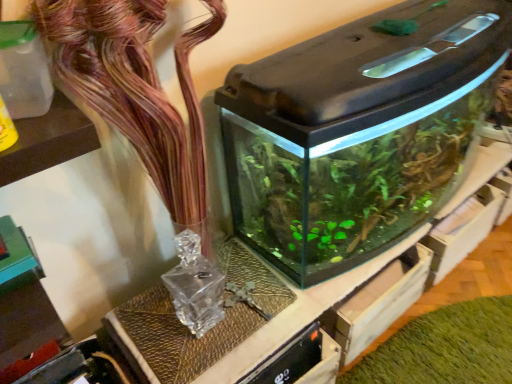
You are a GUI agent. You are given a task and a screenshot of the screen. Output one action in this format:
    pyautogui.click(x=<x>, y=<y>)
    Task: Click on the translucent glass vase at upper center
    The image size is (512, 384).
    Given the screenshot: What is the action you would take?
    pyautogui.click(x=136, y=90)

This screenshot has height=384, width=512. What do you see at coordinates (445, 347) in the screenshot? I see `green matte plant at lower right` at bounding box center [445, 347].

The width and height of the screenshot is (512, 384). Find the location of `transparent glass water tank at center`. transparent glass water tank at center is located at coordinates (358, 133).

Is translucent glass vase at upper center facing away from transparent glass water tank at center?

translucent glass vase at upper center does not have its back to transparent glass water tank at center.

From a real-world perspective, is translucent glass vase at upper center physically below transparent glass water tank at center?

No.

Could transparent glass water tank at center be considered to be inside translucent glass vase at upper center?

That's incorrect, transparent glass water tank at center is not inside translucent glass vase at upper center.

Who is bigger, translucent glass vase at upper center or transparent glass water tank at center?

With larger size is transparent glass water tank at center.

Can you confirm if green matte plant at lower right is wider than translucent glass vase at upper center?

Indeed, green matte plant at lower right has a greater width compared to translucent glass vase at upper center.

Looking at this image, considering the relative positions of green matte plant at lower right and translucent glass vase at upper center in the image provided, is green matte plant at lower right to the left or to the right of translucent glass vase at upper center?

Based on their positions, green matte plant at lower right is located to the right of translucent glass vase at upper center.

From a real-world perspective, between green matte plant at lower right and translucent glass vase at upper center, who is vertically higher?

translucent glass vase at upper center, from a real-world perspective.

Where is `plant behind the translucent glass vase at upper center`? This screenshot has width=512, height=384. plant behind the translucent glass vase at upper center is located at coordinates (445, 347).

Considering the relative positions of green matte plant at lower right and transparent glass water tank at center in the image provided, is green matte plant at lower right behind transparent glass water tank at center?

Yes, green matte plant at lower right is further from the camera.

You are a GUI agent. You are given a task and a screenshot of the screen. Output one action in this format:
    pyautogui.click(x=<x>, y=<y>)
    Task: Click on the plant to the right of transparent glass water tank at center
    The height and width of the screenshot is (384, 512).
    Given the screenshot: What is the action you would take?
    pyautogui.click(x=445, y=347)

From a real-world perspective, which is physically above, green matte plant at lower right or transparent glass water tank at center?

transparent glass water tank at center, from a real-world perspective.

Is transparent glass water tank at center surrounded by green matte plant at lower right?

No, transparent glass water tank at center is located outside of green matte plant at lower right.

Are transparent glass water tank at center and translucent glass vase at upper center far apart?

No.

From a real-world perspective, which object stands above the other?

In real-world perspective, translucent glass vase at upper center is above.

Considering the relative sizes of transparent glass water tank at center and translucent glass vase at upper center in the image provided, is transparent glass water tank at center thinner than translucent glass vase at upper center?

Incorrect, the width of transparent glass water tank at center is not less than that of translucent glass vase at upper center.

Considering the positions of objects transparent glass water tank at center and translucent glass vase at upper center in the image provided, who is more to the left, transparent glass water tank at center or translucent glass vase at upper center?

From the viewer's perspective, translucent glass vase at upper center appears more on the left side.

Can you confirm if transparent glass water tank at center is wider than green matte plant at lower right?

Incorrect, the width of transparent glass water tank at center does not surpass that of green matte plant at lower right.

From the image's perspective, between transparent glass water tank at center and green matte plant at lower right, which one is located above?

transparent glass water tank at center appears higher in the image.

From a real-world perspective, is transparent glass water tank at center physically located above or below green matte plant at lower right?

From a real-world perspective, transparent glass water tank at center is physically above green matte plant at lower right.

Is point (341, 100) behind point (503, 313)?

No.

Is translucent glass vase at upper center oriented towards green matte plant at lower right?

No, translucent glass vase at upper center is not oriented towards green matte plant at lower right.

In the image, is translucent glass vase at upper center on the left side or the right side of green matte plant at lower right?

translucent glass vase at upper center is positioned on green matte plant at lower right's left side.

What's the angular difference between translucent glass vase at upper center and green matte plant at lower right's facing directions?

The angular difference between translucent glass vase at upper center and green matte plant at lower right is 87.4 degrees.

Locate an element on the screen. flower that appears below the transparent glass water tank at center (from the image's perspective) is located at coordinates pyautogui.click(x=136, y=90).

Locate an element on the screen. The height and width of the screenshot is (384, 512). flower located above the green matte plant at lower right (from a real-world perspective) is located at coordinates (136, 90).

Consider the image. Estimate the real-world distances between objects in this image. Which object is closer to green matte plant at lower right, transparent glass water tank at center or translucent glass vase at upper center?

Among the two, transparent glass water tank at center is located nearer to green matte plant at lower right.

Based on their spatial positions, is translucent glass vase at upper center or transparent glass water tank at center further from green matte plant at lower right?

translucent glass vase at upper center lies further to green matte plant at lower right than the other object.

Considering their positions, is translucent glass vase at upper center positioned closer to transparent glass water tank at center than green matte plant at lower right?

translucent glass vase at upper center.

Considering their positions, is transparent glass water tank at center positioned closer to translucent glass vase at upper center than green matte plant at lower right?

transparent glass water tank at center is positioned closer to the anchor translucent glass vase at upper center.

Estimate the real-world distances between objects in this image. Which object is closer to translucent glass vase at upper center, green matte plant at lower right or transparent glass water tank at center?

transparent glass water tank at center is positioned closer to the anchor translucent glass vase at upper center.

Looking at the image, which one is located further to transparent glass water tank at center, green matte plant at lower right or translucent glass vase at upper center?

Based on the image, green matte plant at lower right appears to be further to transparent glass water tank at center.

Find the location of `water tank located between translucent glass vase at upper center and green matte plant at lower right in the left-right direction`. water tank located between translucent glass vase at upper center and green matte plant at lower right in the left-right direction is located at coordinates (358, 133).